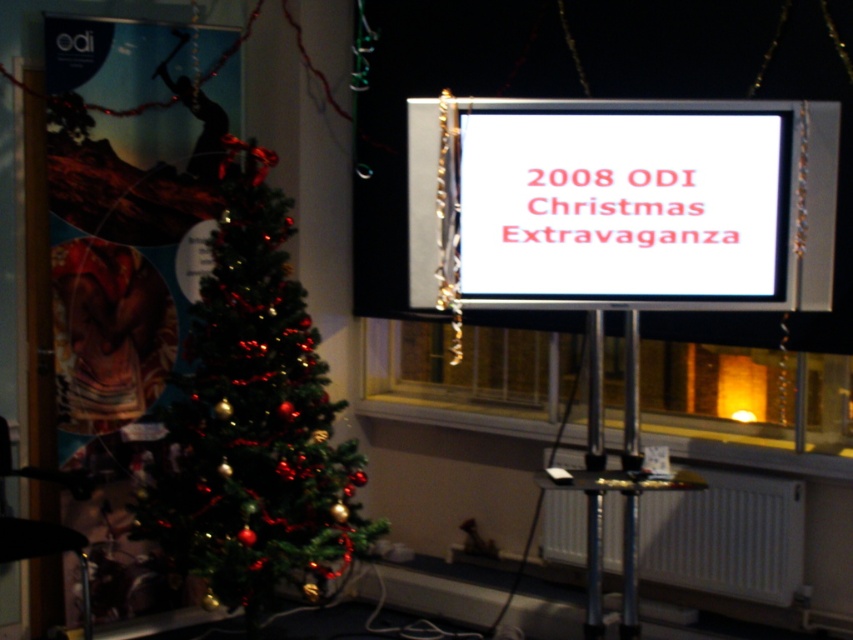
You are setting up decorations for the event and need to place a new ornament. The ornament is too heavy for the green shiny christmas tree at left but can be safely placed on the white plastic radiator at lower right. However, you want to ensure it won

The green shiny christmas tree at left is positioned on the left side of the white plastic radiator at lower right, so the white plastic radiator at lower right is to the right of the tree. Since the ornament is too heavy for the tree, you should place it on the white plastic radiator at lower right which is located to the right of the tree.

You are standing in the room and want to adjust the white plastic radiator at lower right. To reach it, you need to move around the white glossy screen at center. Is the radiator behind the screen or in front of it?

The white glossy screen at center is closer to the viewer than the white plastic radiator at lower right, so the radiator is behind the screen.

You are standing in the festive indoor setting and want to take a photo of the green shiny christmas tree at left. The camera you are using has a minimum focus distance of 3 meters. Will the camera be able to focus on the tree?

The green shiny christmas tree at left is 3.30 meters away from camera. Since the minimum focus distance is 3 meters, the camera can focus on the tree as it is beyond the minimum required distance.